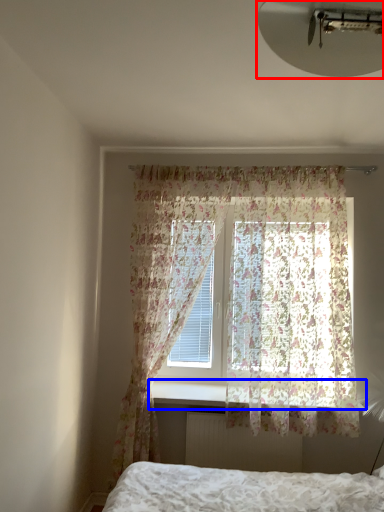
Question: Among these objects, which one is farthest to the camera, light fixture (highlighted by a red box) or window sill (highlighted by a blue box)?

Choices:
 (A) light fixture
 (B) window sill

Answer: (B)